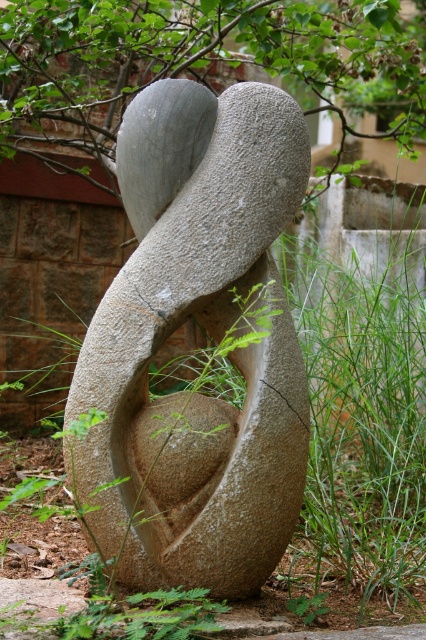
Is point (299, 493) closer to camera compared to point (5, 600)?

No, it is behind (5, 600).

Between point (184, 426) and point (423, 636), which one is positioned behind?

Positioned behind is point (184, 426).

Which is behind, point (216, 289) or point (20, 465)?

Point (20, 465)

Identify the location of granite sculpture at center. (210, 333).